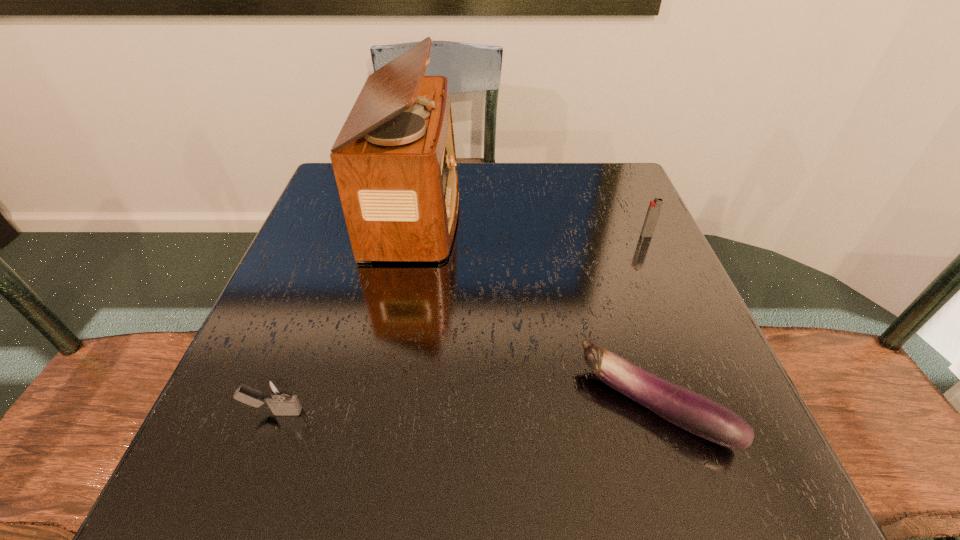
Locate an element on the screen. Image resolution: width=960 pixels, height=540 pixels. the tallest object is located at coordinates (394, 161).

Where is `the third object from right to left`? the third object from right to left is located at coordinates (394, 161).

Where is `the farther igniter`? The image size is (960, 540). the farther igniter is located at coordinates (655, 206).

Identify the location of the left igniter. The height and width of the screenshot is (540, 960). (276, 392).

The image size is (960, 540). Find the location of `the nearer igniter`. the nearer igniter is located at coordinates (276, 392).

The image size is (960, 540). Identify the location of the shortest object. (694, 412).

This screenshot has height=540, width=960. I want to click on free spot located on the front panel of the radio receiver, so click(x=517, y=211).

Where is `vacant space located 0.220m on the back of the right igniter`? vacant space located 0.220m on the back of the right igniter is located at coordinates (622, 182).

You are a GUI agent. You are given a task and a screenshot of the screen. Output one action in this format:
    pyautogui.click(x=<x>, y=<y>)
    Task: Click on the free space located 0.360m on the right of the leftmost object
    The image size is (960, 540).
    Given the screenshot: What is the action you would take?
    pyautogui.click(x=541, y=411)

The image size is (960, 540). Find the location of `vacant region located 0.170m on the left of the eggplant`. vacant region located 0.170m on the left of the eggplant is located at coordinates (474, 404).